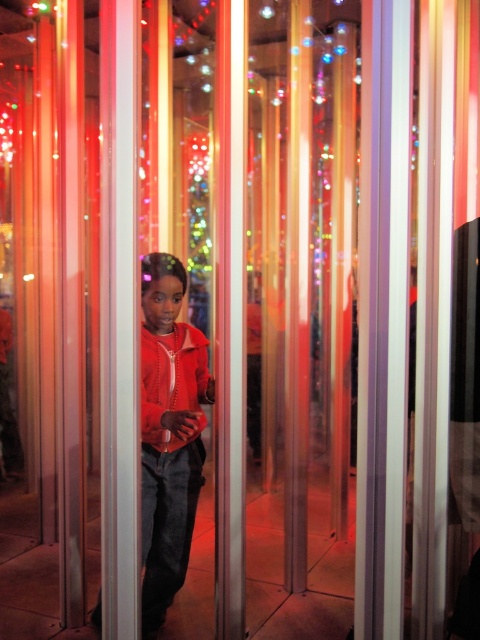
You are a fashion designer observing the scene and want to know which piece of clothing is closer to you. Which one is closer between the matte orange jacket at center and the matte red sweatshirt at center?

The matte orange jacket at center is closer to you because it is positioned further to the viewer than the matte red sweatshirt at center.

You are a fashion designer observing the scene. You need to decide which garment to recommend for a client who prefers a more voluminous look. Which one between the matte orange jacket at center and the matte red sweatshirt at center would you suggest?

The matte orange jacket at center has a larger width than the matte red sweatshirt at center, so it would be the better recommendation for a more voluminous look.

You are a fashion designer observing the scene and need to decide which garment to feature in your upcoming collection. Based on the size comparison between the matte orange jacket at center and the matte red sweatshirt at center, which one would you choose if you want to emphasize a bold, oversized look?

The matte orange jacket at center is larger in size than the matte red sweatshirt at center, so it would be the better choice to emphasize a bold, oversized look.